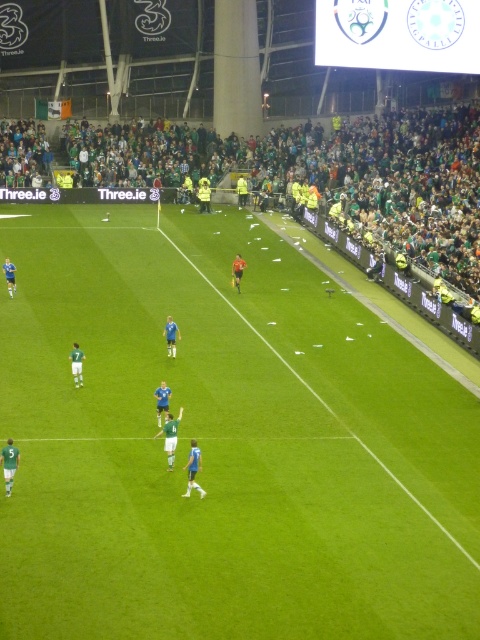
Question: Observing the image, what is the correct spatial positioning of green grass field at center in reference to green fabric crowd at upper center?

Choices:
 (A) right
 (B) left

Answer: (A)

Question: Which of the following is the closest to the observer?

Choices:
 (A) (199, 312)
 (B) (145, 172)

Answer: (A)

Question: Does green grass field at center come in front of green fabric crowd at upper center?

Choices:
 (A) yes
 (B) no

Answer: (A)

Question: Which of the following is the farthest from the observer?

Choices:
 (A) (229, 161)
 (B) (7, 502)

Answer: (A)

Question: Can you confirm if green grass field at center is wider than green fabric crowd at upper center?

Choices:
 (A) no
 (B) yes

Answer: (A)